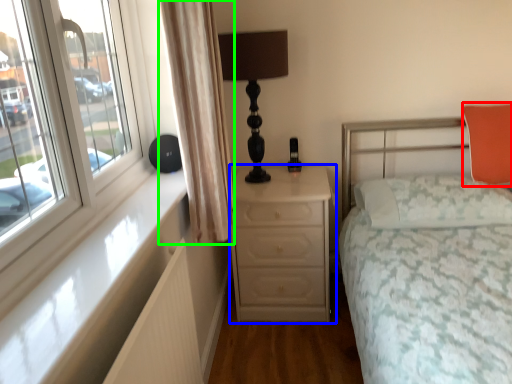
Question: Which object is the closest to the pillow (highlighted by a red box)? Choose among these: chest of drawers (highlighted by a blue box) or curtain (highlighted by a green box).

Choices:
 (A) chest of drawers
 (B) curtain

Answer: (A)